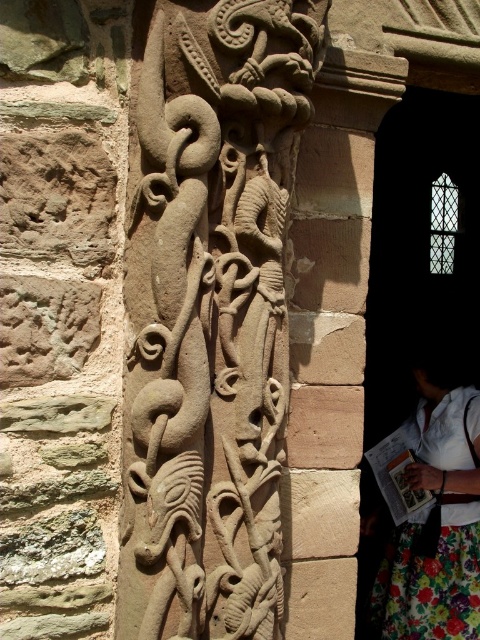
Based on the photo, you are an architect examining the intricate carvings on the stone column. You notice a specific point marked at coordinates point(330, 339). What does this point indicate on the carved stone pillar at center?

The point(330, 339) indicates the center of the carved stone pillar at center.

You are an architect examining the stone column. You need to determine if the stone textured dragon at center can be seen above the floral skirt at lower right. Based on the scene, can you confirm this?

The stone textured dragon at center is much taller than the floral skirt at lower right, so yes, the dragon can be seen above the floral skirt at lower right.

From the picture: Based on the scene description, which object is positioned higher in the image, the stone textured dragon at center or the carved stone pillar at center?

The stone textured dragon at center is positioned above the carved stone pillar at center, so it is higher in the image.